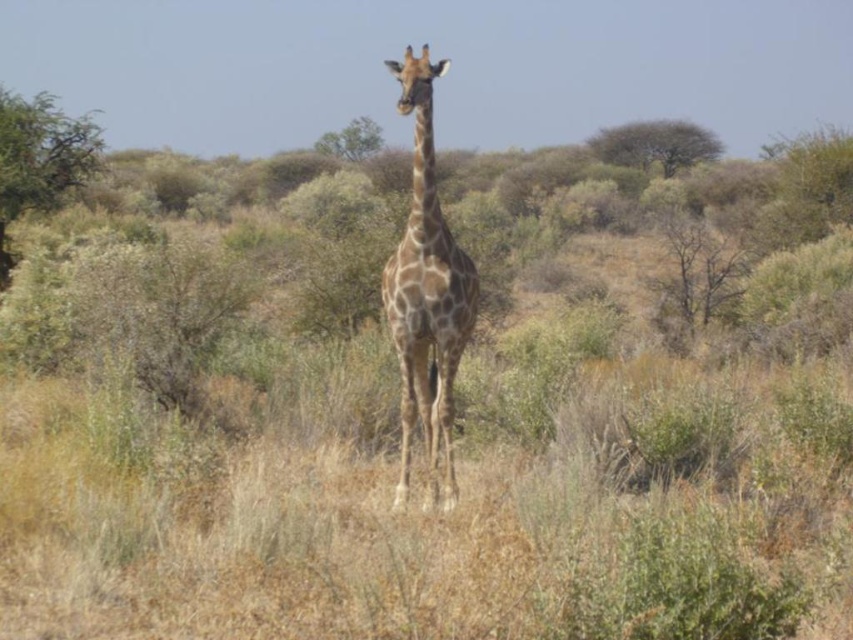
You are a bird flying over the savanna and want to land on a green leafy shrub at left or a green leafy tree at center. Which one is closer to you as you approach from above?

The green leafy shrub at left is closer to you because it is in front of the green leafy tree at center.

You are standing at the center of the image and want to walk towards the green leafy shrub at left. In which direction should you head?

The green leafy shrub at left is located at point 0.248 on the x and 0.047 on the y, so you should head to the left and slightly forward to reach it.